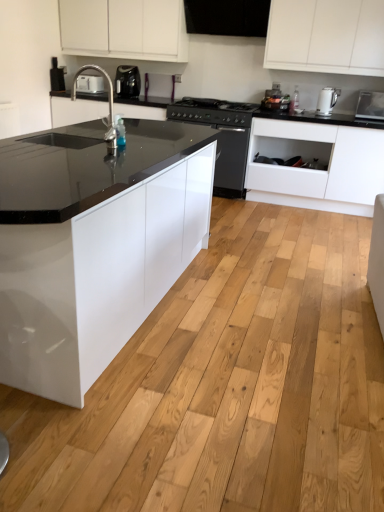
Question: Does point (173, 115) appear closer or farther from the camera than point (331, 97)?

Choices:
 (A) farther
 (B) closer

Answer: (A)

Question: Would you say black matte stove at center is to the left or to the right of white glossy electric kettle at upper right, which is the second kitchen appliance in top-to-bottom order, in the picture?

Choices:
 (A) right
 (B) left

Answer: (B)

Question: Considering the real-world distances, which object is farthest from the white glossy electric kettle at upper right, which is the second kitchen appliance in left-to-right order?

Choices:
 (A) black glossy dishwasher at center
 (B) white matte cabinet at center, the 2th cabinetry in the left-to-right sequence
 (C) silver metallic faucet at center
 (D) satin silver toaster at upper right, placed as the second appliance when sorted from back to front
 (E) transparent plastic bottle at center

Answer: (C)

Question: Considering the real-world distances, which object is farthest from the black glossy dishwasher at center?

Choices:
 (A) black matte stove at center
 (B) white glossy cabinet at upper center, which ranks as the first cabinetry in left-to-right order
 (C) white matte cabinet at center, which is the first cabinetry in right-to-left order
 (D) silver metallic faucet at center
 (E) white plastic toaster at upper left, positioned as the first appliance in back-to-front order

Answer: (D)